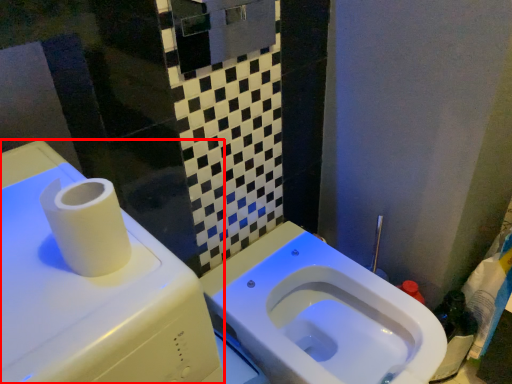
Question: Observing the image, what is the correct spatial positioning of water tank (annotated by the red box) in reference to toilet?

Choices:
 (A) right
 (B) left

Answer: (B)